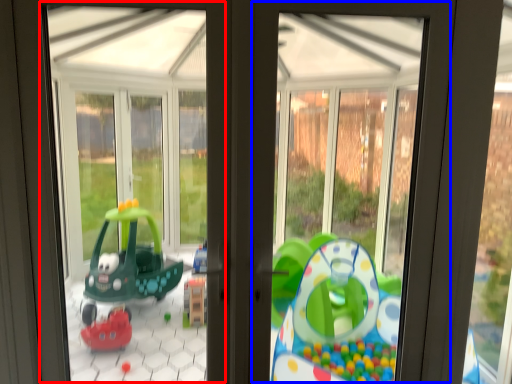
Question: Which object appears closest to the camera in this image, bay window (highlighted by a red box) or window frame (highlighted by a blue box)?

Choices:
 (A) bay window
 (B) window frame

Answer: (A)